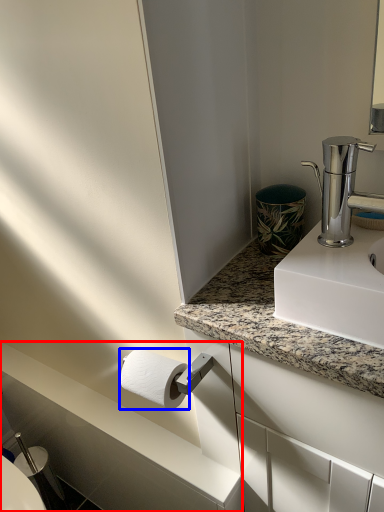
Question: Among these objects, which one is nearest to the camera, counter top (highlighted by a red box) or toilet paper (highlighted by a blue box)?

Choices:
 (A) counter top
 (B) toilet paper

Answer: (B)